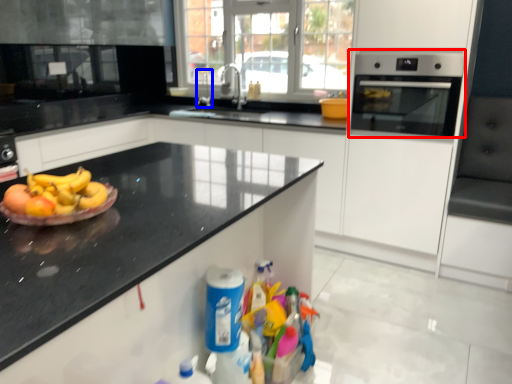
Question: Which point is further to the camera, home appliance (highlighted by a red box) or faucet (highlighted by a blue box)?

Choices:
 (A) home appliance
 (B) faucet

Answer: (B)